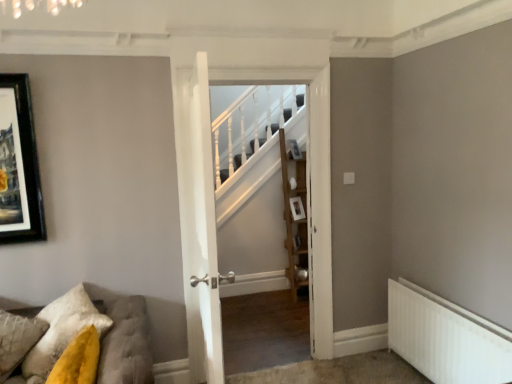
Question: From a real-world perspective, is white wooden door at center, the 1th door when ordered from front to back, above or below wooden shelf at center?

Choices:
 (A) above
 (B) below

Answer: (A)

Question: Considering the positions of point (207, 218) and point (293, 297), is point (207, 218) closer or farther from the camera than point (293, 297)?

Choices:
 (A) farther
 (B) closer

Answer: (B)

Question: Based on their relative distances, which object is farther from the tufted fabric sofa at lower left?

Choices:
 (A) white metallic radiator at lower right
 (B) white wooden door at center, which is the 1th door in back-to-front order
 (C) wooden shelf at center
 (D) white wooden door at center, the 1th door when ordered from front to back
 (E) textured yellow pillow at lower left

Answer: (C)

Question: Estimate the real-world distances between objects in this image. Which object is farther from the white wooden door at center, which is counted as the 2th door, starting from the front?

Choices:
 (A) textured yellow pillow at lower left
 (B) tufted fabric sofa at lower left
 (C) white metallic radiator at lower right
 (D) white wooden door at center, which ranks as the second door in back-to-front order
 (E) wooden shelf at center

Answer: (E)